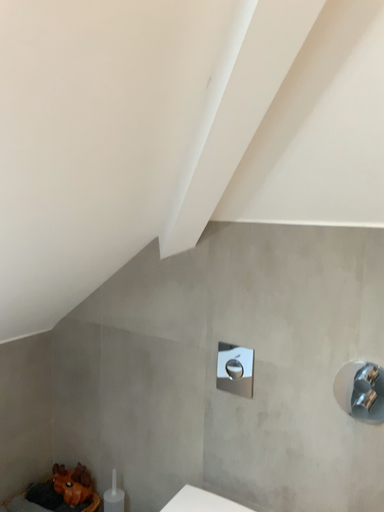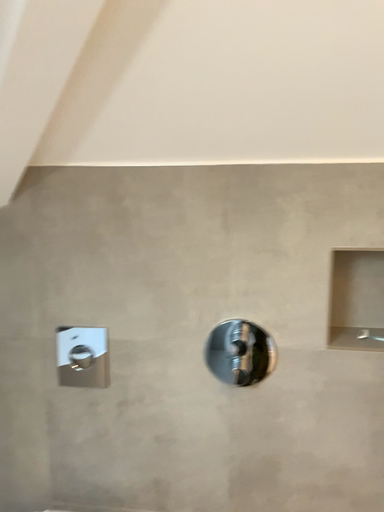
Question: Which way did the camera rotate in the video?

Choices:
 (A) rotated right
 (B) rotated left

Answer: (A)